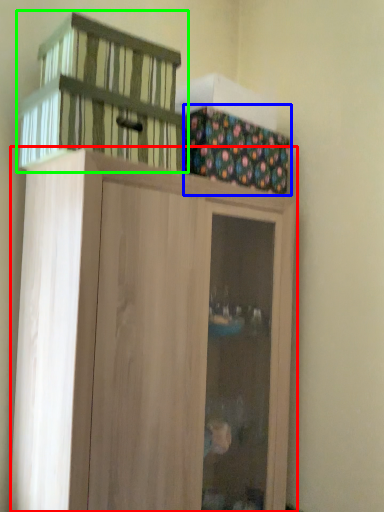
Question: Based on their relative distances, which object is farther from cupboard (highlighted by a red box)? Choose from cabinetry (highlighted by a blue box) and basket (highlighted by a green box).

Choices:
 (A) cabinetry
 (B) basket

Answer: (A)